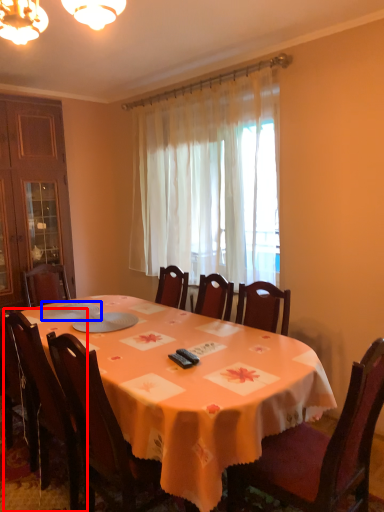
Question: Which object is closer to the camera taking this photo, chair (highlighted by a red box) or tableware (highlighted by a blue box)?

Choices:
 (A) chair
 (B) tableware

Answer: (A)